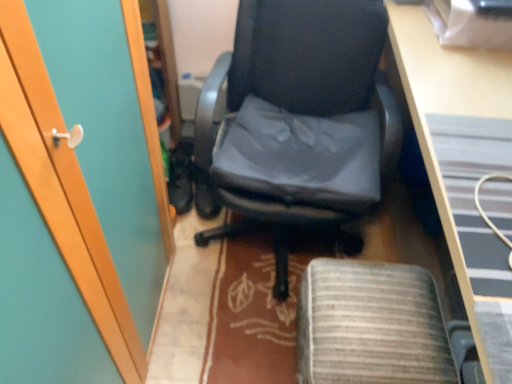
Question: Is point (462, 134) positioned closer to the camera than point (189, 190)?

Choices:
 (A) closer
 (B) farther

Answer: (A)

Question: Is wooden desk at center taller or shorter than black leather shoes at lower left?

Choices:
 (A) tall
 (B) short

Answer: (A)

Question: Considering the real-world distances, which object is farthest from the wooden desk at center?

Choices:
 (A) gray fabric computer chair at center
 (B) black leather chair at center
 (C) black leather shoes at lower left

Answer: (C)

Question: Estimate the real-world distances between objects in this image. Which object is farther from the black leather shoes at lower left?

Choices:
 (A) gray fabric computer chair at center
 (B) black leather chair at center
 (C) wooden desk at center

Answer: (C)